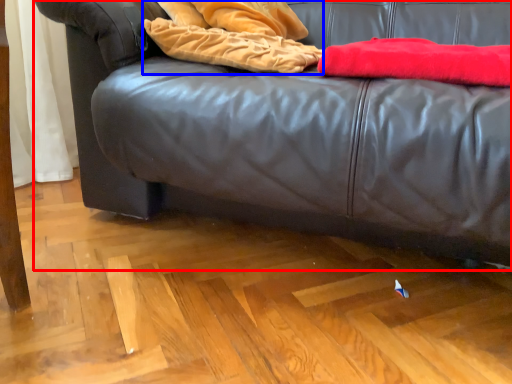
Question: Among these objects, which one is farthest to the camera, studio couch (highlighted by a red box) or blanket (highlighted by a blue box)?

Choices:
 (A) studio couch
 (B) blanket

Answer: (B)